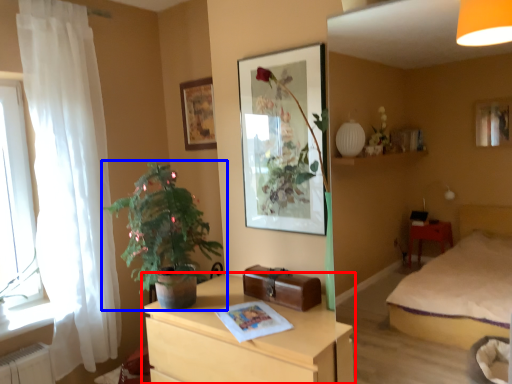
Question: Among these objects, which one is farthest to the camera, chest of drawers (highlighted by a red box) or houseplant (highlighted by a blue box)?

Choices:
 (A) chest of drawers
 (B) houseplant

Answer: (B)